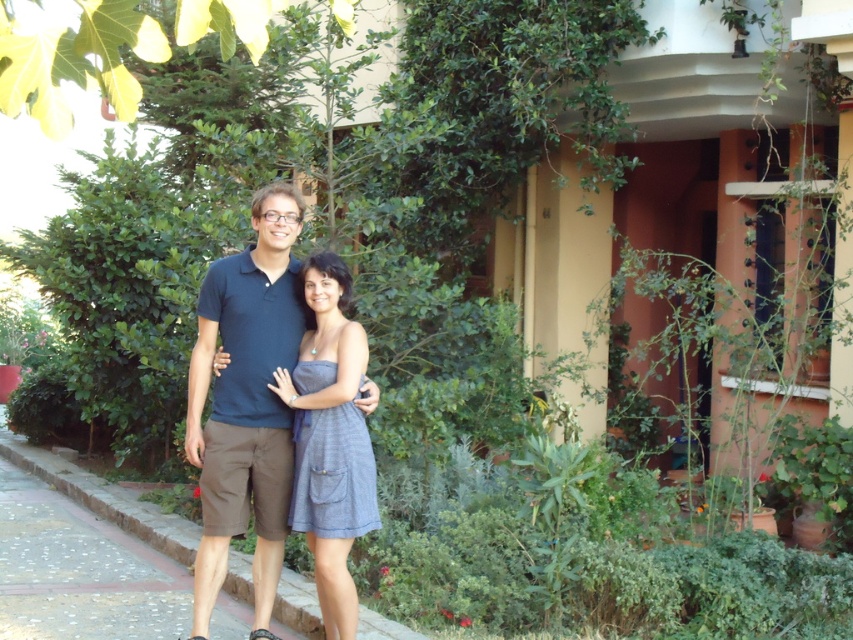
Does dark blue cotton shirt at center appear on the left side of gray woven dress at center?

Correct, you'll find dark blue cotton shirt at center to the left of gray woven dress at center.

Can you confirm if dark blue cotton shirt at center is positioned below gray woven dress at center?

No, dark blue cotton shirt at center is not below gray woven dress at center.

Between point (260, 292) and point (344, 556), which one is positioned behind?

The point (260, 292) is behind.

I want to click on dark blue cotton shirt at center, so click(247, 403).